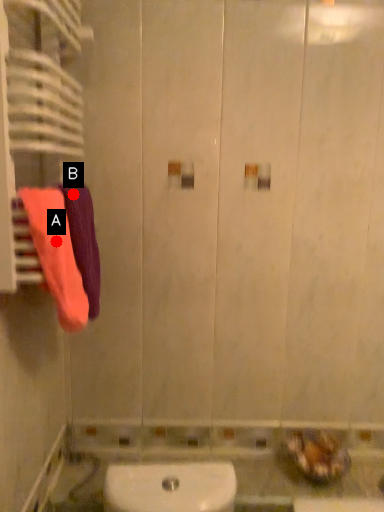
Question: Two points are circled on the image, labeled by A and B beside each circle. Which point is closer to the camera taking this photo?

Choices:
 (A) A is closer
 (B) B is closer

Answer: (A)